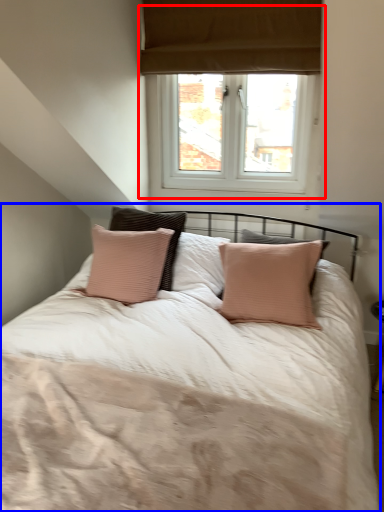
Question: Which point is closer to the camera, window (highlighted by a red box) or bed (highlighted by a blue box)?

Choices:
 (A) window
 (B) bed

Answer: (B)